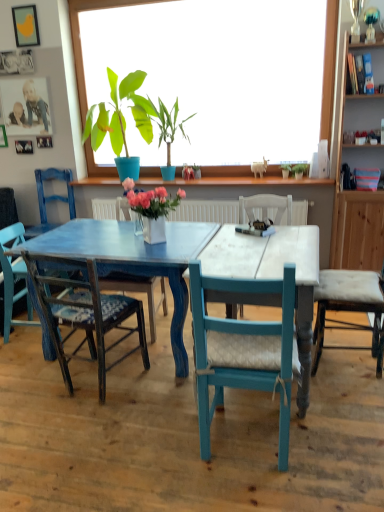
Describe the element at coordinates (25, 106) in the screenshot. The height and width of the screenshot is (512, 384). I see `matte wooden picture frame at upper left, the fourth picture frame from the bottom` at that location.

What do you see at coordinates (86, 317) in the screenshot? The image size is (384, 512). I see `blue woven fabric chair at center, positioned as the 3th chair in left-to-right order` at bounding box center [86, 317].

In order to click on wooden bookshelf at upper right in this screenshot , I will do `click(357, 191)`.

The image size is (384, 512). Describe the element at coordinates (357, 191) in the screenshot. I see `wooden bookshelf at upper right` at that location.

What are the coordinates of `brushed metal picture frame at upper left, which is counted as the 4th picture frame, starting from the top` in the screenshot? It's located at (44, 141).

Describe the element at coordinates (44, 141) in the screenshot. Image resolution: width=384 pixels, height=512 pixels. I see `brushed metal picture frame at upper left, which is counted as the 4th picture frame, starting from the top` at that location.

Find the location of a particular element. wooden woven chair at lower left, which ranks as the fifth chair in right-to-left order is located at coordinates (9, 262).

Find the location of a particular element. This screenshot has height=512, width=384. the 2nd chair to the right of the brushed metal picture frame at upper left, which is counted as the 4th picture frame, starting from the top, starting your count from the anchor is located at coordinates (9, 262).

Which of these two, wooden woven chair at lower left, the second chair from the left, or brushed metal picture frame at upper left, the 2th picture frame from the bottom, stands shorter?

With less height is brushed metal picture frame at upper left, the 2th picture frame from the bottom.

Is wooden woven chair at lower left, the second chair from the left, positioned far away from brushed metal picture frame at upper left, which is counted as the 4th picture frame, starting from the top?

Yes, wooden woven chair at lower left, the second chair from the left, is far from brushed metal picture frame at upper left, which is counted as the 4th picture frame, starting from the top.

Would you say wooden woven chair at lower left, the second chair from the left, is inside or outside brushed metal picture frame at upper left, which is counted as the 4th picture frame, starting from the top?

wooden woven chair at lower left, the second chair from the left, cannot be found inside brushed metal picture frame at upper left, which is counted as the 4th picture frame, starting from the top.

Visually, is wooden bookshelf at upper right positioned to the left or to the right of green matte plant at center, the fourth houseplant from the right?

From the image, it's evident that wooden bookshelf at upper right is to the right of green matte plant at center, the fourth houseplant from the right.

Considering the sizes of objects wooden bookshelf at upper right and green matte plant at center, which appears as the 2th houseplant when viewed from the front, in the image provided, who is bigger, wooden bookshelf at upper right or green matte plant at center, which appears as the 2th houseplant when viewed from the front,?

green matte plant at center, which appears as the 2th houseplant when viewed from the front.

There is a wooden bookshelf at upper right. Where is `the 1st houseplant above it (from a real-world perspective)`? This screenshot has width=384, height=512. the 1st houseplant above it (from a real-world perspective) is located at coordinates (169, 125).

Is wooden bookshelf at upper right next to green matte plant at center, the fourth houseplant positioned from the back?

No, wooden bookshelf at upper right is not in contact with green matte plant at center, the fourth houseplant positioned from the back.

How distant is green matte plant at center, which appears as the 2th houseplant when viewed from the front, from teal wood chair at center, the 2th chair positioned from the right?

2.60 meters.

From the image's perspective, which is below, green matte plant at center, the 2th houseplant viewed from the left, or teal wood chair at center, the fifth chair when ordered from left to right?

From the image's view, teal wood chair at center, the fifth chair when ordered from left to right, is below.

Considering the sizes of objects green matte plant at center, which appears as the 2th houseplant when viewed from the front, and teal wood chair at center, the 2th chair positioned from the right, in the image provided, who is wider, green matte plant at center, which appears as the 2th houseplant when viewed from the front, or teal wood chair at center, the 2th chair positioned from the right,?

teal wood chair at center, the 2th chair positioned from the right.

Is point (159, 103) positioned before point (225, 279)?

No.

Which of these two, white ceramic vase at center, the 3th houseplant when ordered from right to left, or brushed metal picture frame at upper left, arranged as the fifth picture frame when viewed from the top, is smaller?

Smaller between the two is brushed metal picture frame at upper left, arranged as the fifth picture frame when viewed from the top.

Considering their positions, is white ceramic vase at center, the 3th houseplant when ordered from right to left, located in front of or behind brushed metal picture frame at upper left, arranged as the fifth picture frame when viewed from the top?

Visually, white ceramic vase at center, the 3th houseplant when ordered from right to left, is located in front of brushed metal picture frame at upper left, arranged as the fifth picture frame when viewed from the top.

From a real-world perspective, which is physically below, white ceramic vase at center, the 1th houseplant viewed from the front, or brushed metal picture frame at upper left, arranged as the fifth picture frame when viewed from the top?

white ceramic vase at center, the 1th houseplant viewed from the front.

Which of these two, white ceramic vase at center, the 3th houseplant when ordered from right to left, or brushed metal picture frame at upper left, arranged as the fifth picture frame when viewed from the top, stands shorter?

With less height is brushed metal picture frame at upper left, arranged as the fifth picture frame when viewed from the top.

Locate an element on the screen. Image resolution: width=384 pixels, height=512 pixels. the 4th picture frame above the blue wood chair at left, acting as the 1th chair starting from the left (from the image's perspective) is located at coordinates (25, 106).

How far apart are matte wooden picture frame at upper left, arranged as the second picture frame when viewed from the top, and blue wood chair at left, acting as the 1th chair starting from the left?

The distance of matte wooden picture frame at upper left, arranged as the second picture frame when viewed from the top, from blue wood chair at left, acting as the 1th chair starting from the left, is 24.21 inches.

Is matte wooden picture frame at upper left, arranged as the second picture frame when viewed from the top, behind blue wood chair at left, the 6th chair positioned from the right?

Yes.

Is matte wooden picture frame at upper left, arranged as the second picture frame when viewed from the top, at the left side of blue wood chair at left, the 6th chair positioned from the right?

Yes.

Is matte yellow bird at upper left, which appears as the first picture frame when viewed from the top, oriented towards white upholstered chair at right, positioned as the sixth chair in left-to-right order?

No, matte yellow bird at upper left, which appears as the first picture frame when viewed from the top, is not oriented towards white upholstered chair at right, positioned as the sixth chair in left-to-right order.

Which of these two, matte yellow bird at upper left, which appears as the first picture frame when viewed from the top, or white upholstered chair at right, placed as the 1th chair when sorted from right to left, stands taller?

white upholstered chair at right, placed as the 1th chair when sorted from right to left.

From the image's perspective, is matte yellow bird at upper left, marked as the fifth picture frame in a bottom-to-top arrangement, under white upholstered chair at right, placed as the 1th chair when sorted from right to left?

No.

Considering the positions of point (32, 35) and point (372, 276), is point (32, 35) closer or farther from the camera than point (372, 276)?

Point (32, 35) appears to be farther away from the viewer than point (372, 276).

Can you tell me how much matte blue chair at center, positioned as the 3th chair in right-to-left order, and teal wood chair at center, the 2th chair positioned from the right, differ in facing direction?

There is a 179-degree angle between the facing directions of matte blue chair at center, positioned as the 3th chair in right-to-left order, and teal wood chair at center, the 2th chair positioned from the right.

Could teal wood chair at center, the fifth chair when ordered from left to right, be considered to be inside matte blue chair at center, arranged as the fourth chair when viewed from the left?

Definitely not — teal wood chair at center, the fifth chair when ordered from left to right, is not inside matte blue chair at center, arranged as the fourth chair when viewed from the left.

Is matte blue chair at center, arranged as the fourth chair when viewed from the left, oriented towards teal wood chair at center, the fifth chair when ordered from left to right?

No, matte blue chair at center, arranged as the fourth chair when viewed from the left, is not facing towards teal wood chair at center, the fifth chair when ordered from left to right.

From the picture: Is matte blue chair at center, arranged as the fourth chair when viewed from the left, bigger than teal wood chair at center, the fifth chair when ordered from left to right?

Yes.

At what (x,y) coordinates should I click in order to perform the action: click on the 2nd picture frame above the wooden woven chair at lower left, which ranks as the fifth chair in right-to-left order (from the image's perspective). Please return your answer as a coordinate pair (x, y). Image resolution: width=384 pixels, height=512 pixels. Looking at the image, I should click on coord(44,141).

Locate an element on the screen. This screenshot has width=384, height=512. cabinetry below the green matte plant at center, the 2th houseplant viewed from the left (from the image's perspective) is located at coordinates (357, 191).

Which object lies nearer to the anchor point teal wood chair at center, the 2th chair positioned from the right, matte blue chair at center, positioned as the 3th chair in right-to-left order, or green leafy plant at upper center, which is the second houseplant in right-to-left order?

Among the two, matte blue chair at center, positioned as the 3th chair in right-to-left order, is located nearer to teal wood chair at center, the 2th chair positioned from the right.

Considering their positions, is green matte plant at upper center, placed as the first houseplant when sorted from right to left, positioned further to blue wood chair at left, the 6th chair positioned from the right, than blue woven fabric chair at center, positioned as the 3th chair in left-to-right order?

green matte plant at upper center, placed as the first houseplant when sorted from right to left, is positioned further to the anchor blue wood chair at left, the 6th chair positioned from the right.

From the image, which object appears to be nearer to matte wooden picture frame at upper left, the fourth picture frame from the bottom, white ceramic vase at center, positioned as the third houseplant in left-to-right order, or brushed metal picture frame at upper left, the first picture frame ordered from the bottom?

brushed metal picture frame at upper left, the first picture frame ordered from the bottom, is positioned closer to the anchor matte wooden picture frame at upper left, the fourth picture frame from the bottom.

From the image, which object appears to be farther from green leafy plant at upper center, the 5th houseplant in the front-to-back sequence, teal wood chair at center, the 2th chair positioned from the right, or brushed metal picture frame at upper left, the 2th picture frame from the bottom?

teal wood chair at center, the 2th chair positioned from the right, lies further to green leafy plant at upper center, the 5th houseplant in the front-to-back sequence, than the other object.

In the scene shown: Based on their spatial positions, is matte wooden picture frame at upper left, the fourth picture frame from the bottom, or matte blue chair at center, positioned as the 3th chair in right-to-left order, closer to brushed metal picture frame at upper left, which is counted as the 4th picture frame, starting from the top?

matte wooden picture frame at upper left, the fourth picture frame from the bottom, is positioned closer to the anchor brushed metal picture frame at upper left, which is counted as the 4th picture frame, starting from the top.

Looking at the image, which one is located closer to green matte plant at center, the 2th houseplant viewed from the left, matte wooden picture frame at upper left, the fourth picture frame from the bottom, or green matte plant at upper center, acting as the 5th houseplant starting from the left?

green matte plant at upper center, acting as the 5th houseplant starting from the left, is closer to green matte plant at center, the 2th houseplant viewed from the left.

Consider the image. Considering their positions, is matte blue chair at center, positioned as the 3th chair in right-to-left order, positioned further to brushed metal picture frame at upper left, the first picture frame ordered from the bottom, than green leafy plant at upper center, which is the second houseplant in right-to-left order?

green leafy plant at upper center, which is the second houseplant in right-to-left order, is positioned further to the anchor brushed metal picture frame at upper left, the first picture frame ordered from the bottom.

Considering their positions, is matte wooden picture frame at upper left, the fourth picture frame from the bottom, positioned further to green matte plant at upper center, which appears as the 5th houseplant when viewed from the right, than brushed metal picture frame at upper left, which is counted as the 4th picture frame, starting from the top?

Among the two, brushed metal picture frame at upper left, which is counted as the 4th picture frame, starting from the top, is located further to green matte plant at upper center, which appears as the 5th houseplant when viewed from the right.

Where is `cabinetry between teal wood chair at center, the fifth chair when ordered from left to right, and green leafy plant at upper center, the 5th houseplant in the front-to-back sequence, in the front-back direction`? The height and width of the screenshot is (512, 384). cabinetry between teal wood chair at center, the fifth chair when ordered from left to right, and green leafy plant at upper center, the 5th houseplant in the front-to-back sequence, in the front-back direction is located at coordinates (357, 191).

This screenshot has height=512, width=384. In order to click on picture frame between matte yellow bird at upper left, which appears as the first picture frame when viewed from the top, and green matte plant at upper center, acting as the 5th houseplant starting from the left, from left to right in this screenshot , I will do `click(44, 141)`.

At what (x,y) coordinates should I click in order to perform the action: click on houseplant situated between blue wood chair at left, the 6th chair positioned from the right, and green matte plant at center, which appears as the 2th houseplant when viewed from the front, from left to right. Please return your answer as a coordinate pair (x, y). Looking at the image, I should click on (120, 114).

The height and width of the screenshot is (512, 384). Identify the location of houseplant situated between matte wooden picture frame at upper left, arranged as the second picture frame when viewed from the top, and green matte plant at center, the 2th houseplant viewed from the left, from left to right. (120, 114).